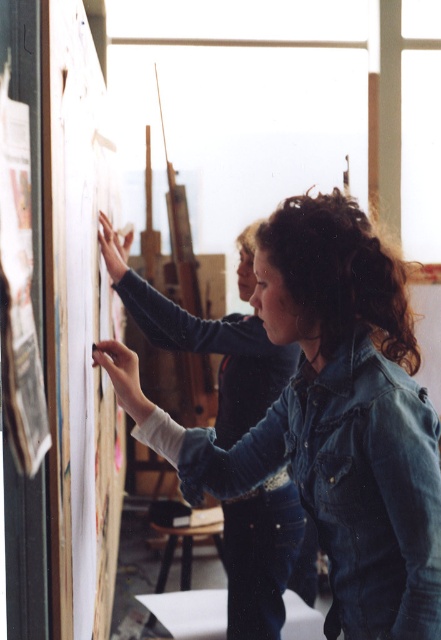
Question: Which object is positioned closest to the denim jacket at lower right?

Choices:
 (A) wooden board at left
 (B) denim jacket at upper center

Answer: (A)

Question: Can you confirm if denim jacket at lower right is smaller than wooden board at left?

Choices:
 (A) no
 (B) yes

Answer: (B)

Question: Among these points, which one is farthest from the camera?

Choices:
 (A) (70, 13)
 (B) (265, 557)

Answer: (B)

Question: Is the position of wooden board at left more distant than that of denim jacket at upper center?

Choices:
 (A) no
 (B) yes

Answer: (A)

Question: Among these points, which one is nearest to the camera?

Choices:
 (A) (172, 346)
 (B) (74, 406)

Answer: (B)

Question: Can you confirm if wooden board at left is thinner than denim jacket at upper center?

Choices:
 (A) no
 (B) yes

Answer: (B)